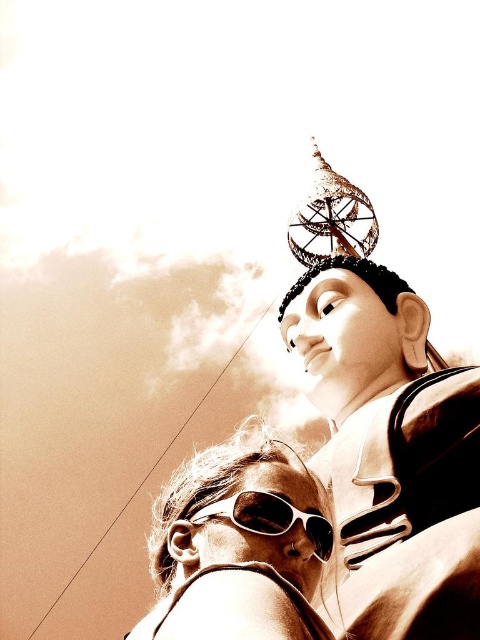
Which is in front, point (469, 588) or point (182, 490)?

Point (469, 588) is more forward.

Which is below, sepia-toned statue at center or sunglasses at lower center?

Positioned lower is sunglasses at lower center.

Where is `sepia-toned statue at center`? This screenshot has height=640, width=480. sepia-toned statue at center is located at coordinates (391, 451).

How much distance is there between sunglasses at lower center and white matte goggles at center?

A distance of 4.82 meters exists between sunglasses at lower center and white matte goggles at center.

Looking at this image, can you confirm if sunglasses at lower center is positioned to the right of white matte goggles at center?

In fact, sunglasses at lower center is to the left of white matte goggles at center.

Who is more distant from viewer, (x=172, y=612) or (x=210, y=508)?

Point (x=210, y=508)

Locate an element on the screen. Image resolution: width=480 pixels, height=640 pixels. sunglasses at lower center is located at coordinates (240, 545).

Can you confirm if sepia-toned statue at center is bigger than white matte goggles at center?

Yes.

Which is behind, point (292, 326) or point (255, 531)?

Positioned behind is point (292, 326).

Find the location of a particular element. Image resolution: width=480 pixels, height=640 pixels. sepia-toned statue at center is located at coordinates (391, 451).